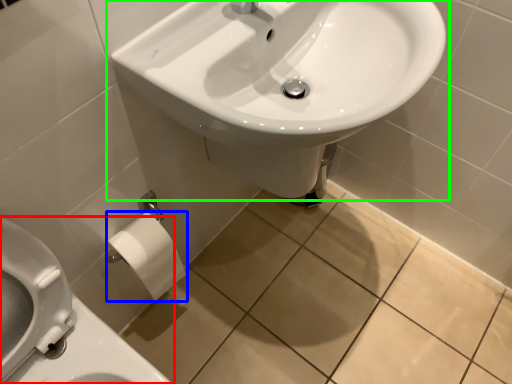
Question: Which is nearer to the toilet (highlighted by a red box)? toilet paper (highlighted by a blue box) or sink (highlighted by a green box).

Choices:
 (A) toilet paper
 (B) sink

Answer: (A)